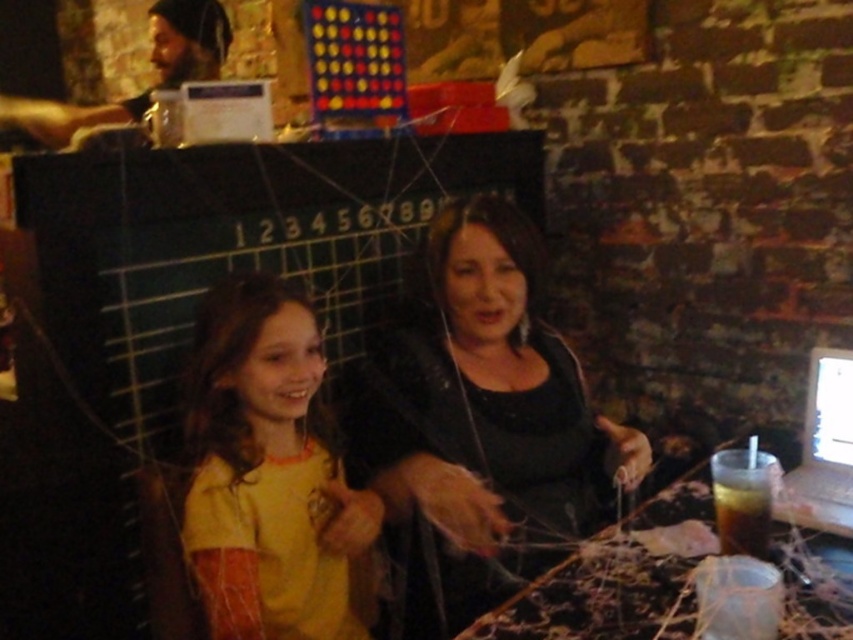
Based on the photo, who is more forward, (817,577) or (833,378)?

Point (817,577) is more forward.

Can you confirm if translucent plastic table at center is positioned to the right of white glossy computer screen at center?

Incorrect, translucent plastic table at center is not on the right side of white glossy computer screen at center.

The image size is (853, 640). Find the location of `translucent plastic table at center`. translucent plastic table at center is located at coordinates (619, 577).

At what (x,y) coordinates should I click in order to perform the action: click on translucent plastic table at center. Please return your answer as a coordinate pair (x, y). Looking at the image, I should click on (619, 577).

Is silver metallic laptop at right to the right of dark brown liquid at lower right from the viewer's perspective?

Yes, silver metallic laptop at right is to the right of dark brown liquid at lower right.

Does silver metallic laptop at right have a smaller size compared to dark brown liquid at lower right?

Incorrect, silver metallic laptop at right is not smaller in size than dark brown liquid at lower right.

Who is more distant from viewer, (787, 488) or (738, 524)?

Point (787, 488)

Locate an element on the screen. The height and width of the screenshot is (640, 853). silver metallic laptop at right is located at coordinates (822, 449).

Does point (489, 308) come farther from viewer compared to point (743, 502)?

Yes.

Who is positioned more to the left, black matte shirt at center or dark brown liquid at lower right?

Positioned to the left is black matte shirt at center.

Is point (403, 492) positioned in front of point (762, 518)?

No, it is behind (762, 518).

Where is `black matte shirt at center`? black matte shirt at center is located at coordinates (480, 422).